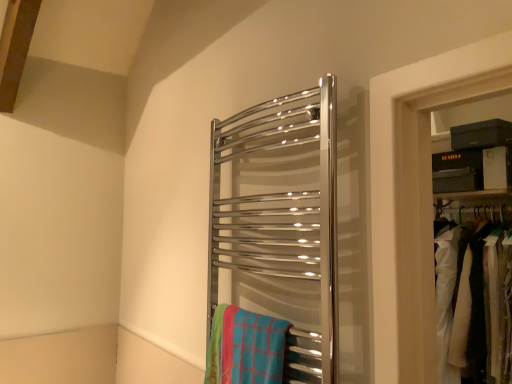
Question: In terms of height, does white fabric at right look taller or shorter compared to blue plaid beach towel at center?

Choices:
 (A) short
 (B) tall

Answer: (B)

Question: From a real-world perspective, is white fabric at right above or below blue plaid beach towel at center?

Choices:
 (A) below
 (B) above

Answer: (B)

Question: Which of these objects is positioned closest to the polished chrome towel rack at center?

Choices:
 (A) white fabric at right
 (B) blue plaid beach towel at center

Answer: (B)

Question: Which object is positioned farthest from the polished chrome towel rack at center?

Choices:
 (A) white fabric at right
 (B) blue plaid beach towel at center

Answer: (A)